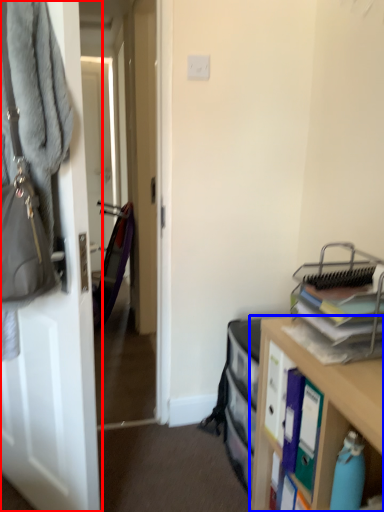
Question: Which object appears farthest to the camera in this image, door (highlighted by a red box) or cabinetry (highlighted by a blue box)?

Choices:
 (A) door
 (B) cabinetry

Answer: (A)